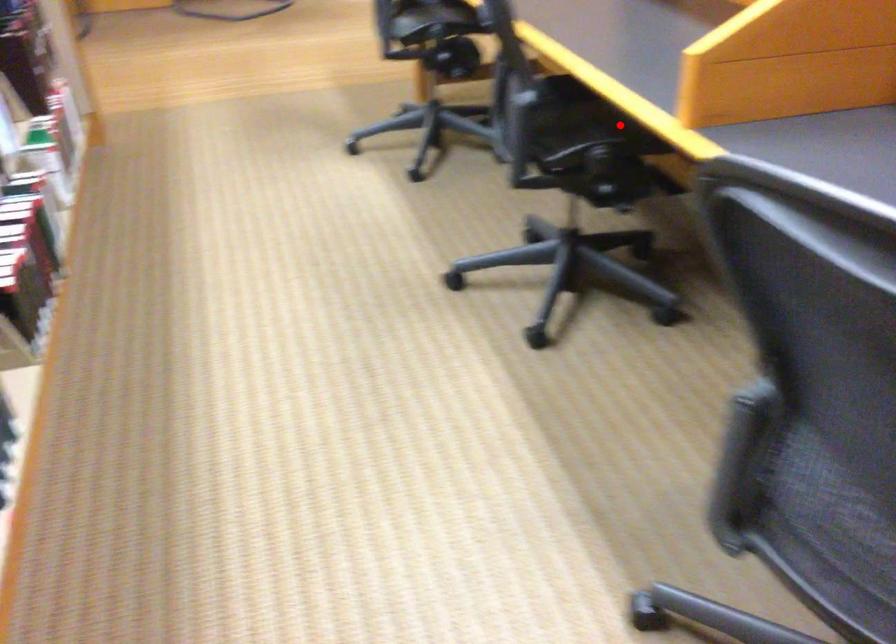
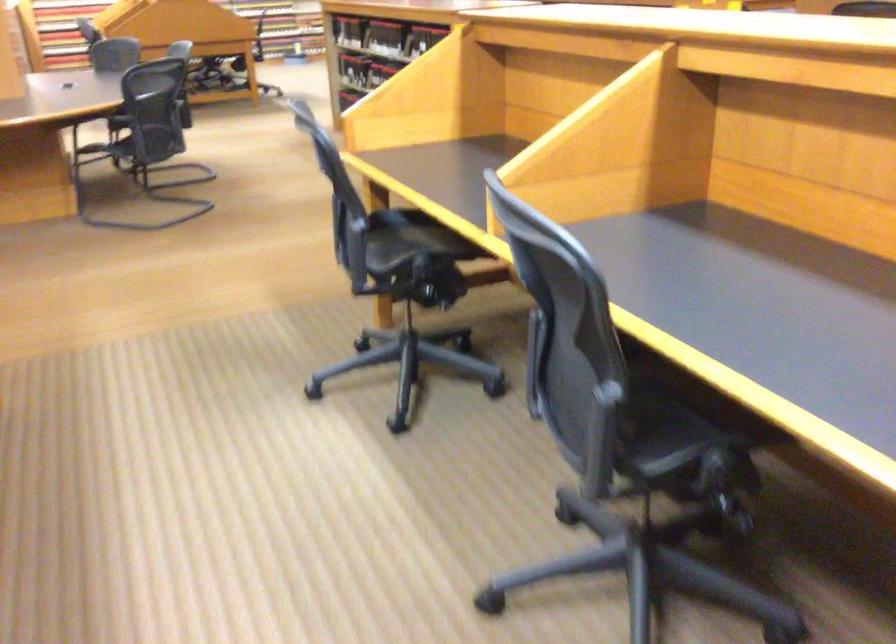
The point at the highlighted location is marked in the first image. Where is the corresponding point in the second image?

(699, 399)